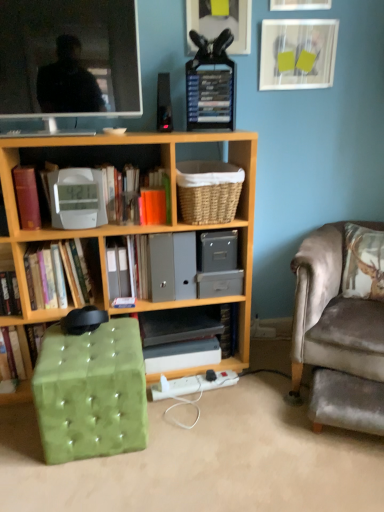
Question: Is matte white picture frame at upper center, acting as the 2th picture frame starting from the right, outside of hardcover books at upper center, the third paperback book in the bottom-to-top sequence?

Choices:
 (A) no
 (B) yes

Answer: (B)

Question: Is hardcover books at upper center, the first paperback book from the right, at the back of matte white picture frame at upper center, acting as the 2th picture frame starting from the right?

Choices:
 (A) no
 (B) yes

Answer: (A)

Question: Considering the relative sizes of matte white picture frame at upper center, acting as the 2th picture frame starting from the right, and hardcover books at upper center, positioned as the 3th paperback book in left-to-right order, in the image provided, is matte white picture frame at upper center, acting as the 2th picture frame starting from the right, thinner than hardcover books at upper center, positioned as the 3th paperback book in left-to-right order,?

Choices:
 (A) no
 (B) yes

Answer: (B)

Question: Does matte white picture frame at upper center, arranged as the 2th picture frame when viewed from the left, appear on the left side of hardcover books at upper center, positioned as the 3th paperback book in left-to-right order?

Choices:
 (A) no
 (B) yes

Answer: (A)

Question: From the image's perspective, is matte white picture frame at upper center, acting as the 2th picture frame starting from the right, under hardcover books at upper center, the first paperback book from the right?

Choices:
 (A) yes
 (B) no

Answer: (B)

Question: Is point (375, 334) positioned closer to the camera than point (185, 384)?

Choices:
 (A) farther
 (B) closer

Answer: (B)

Question: From their relative heights in the image, would you say velvet grey chair at right is taller or shorter than white plastic charger at lower center?

Choices:
 (A) short
 (B) tall

Answer: (B)

Question: Considering the positions of velvet grey chair at right and white plastic charger at lower center in the image, is velvet grey chair at right bigger or smaller than white plastic charger at lower center?

Choices:
 (A) big
 (B) small

Answer: (A)

Question: Would you say velvet grey chair at right is to the left or to the right of white plastic charger at lower center in the picture?

Choices:
 (A) right
 (B) left

Answer: (A)

Question: Considering the positions of wooden bookcase at center and hardcover book at center-left, the 1th book from the left, in the image, is wooden bookcase at center wider or thinner than hardcover book at center-left, the 1th book from the left,?

Choices:
 (A) thin
 (B) wide

Answer: (B)

Question: Is wooden bookcase at center situated inside hardcover book at center-left, the 1th book from the left, or outside?

Choices:
 (A) outside
 (B) inside

Answer: (A)

Question: Considering the relative positions of wooden bookcase at center and hardcover book at center-left, which appears as the 3th book when viewed from the right, in the image provided, is wooden bookcase at center to the left or to the right of hardcover book at center-left, which appears as the 3th book when viewed from the right,?

Choices:
 (A) right
 (B) left

Answer: (A)

Question: Does point (240, 340) appear closer or farther from the camera than point (66, 260)?

Choices:
 (A) closer
 (B) farther

Answer: (B)

Question: In terms of width, does white plastic clock at center, the 2th book in the left-to-right sequence, look wider or thinner when compared to velvet green footrest at lower right?

Choices:
 (A) thin
 (B) wide

Answer: (A)

Question: In the image, is white plastic clock at center, which is the 2th book from right to left, positioned in front of or behind velvet green footrest at lower right?

Choices:
 (A) behind
 (B) front

Answer: (A)